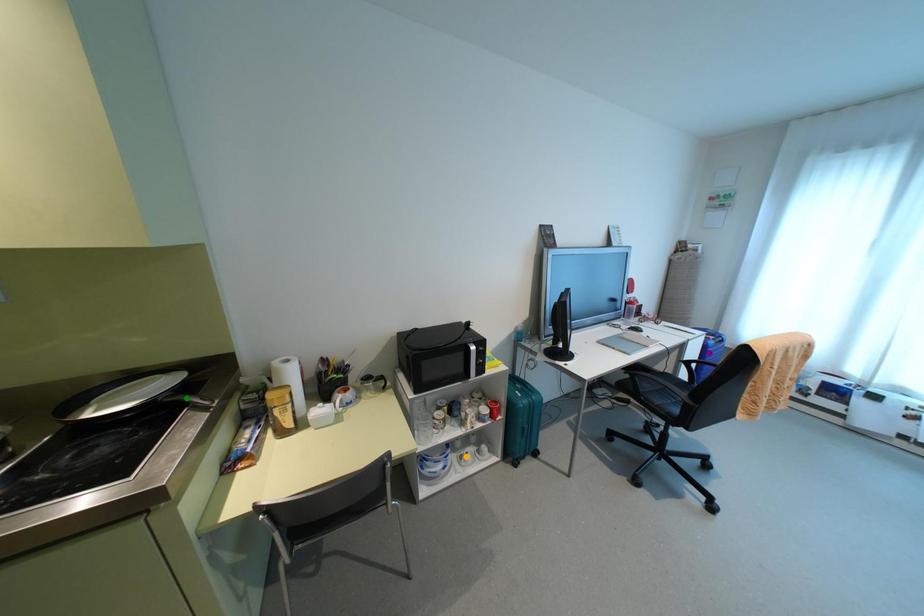
Order these from nearest to farthest:
A) purple point
B) orange point
C) green point

green point
orange point
purple point